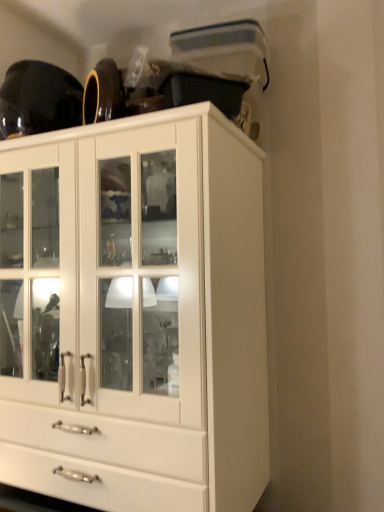
Identify the location of white glossy cupboard at center. Image resolution: width=384 pixels, height=512 pixels. (135, 313).

In the scene shown: Measure the distance between white glossy cupboard at center and camera.

white glossy cupboard at center and camera are 31.52 inches apart.

What do you see at coordinates (135, 313) in the screenshot?
I see `white glossy cupboard at center` at bounding box center [135, 313].

You are a GUI agent. You are given a task and a screenshot of the screen. Output one action in this format:
    pyautogui.click(x=<x>, y=<y>)
    Task: Click on the white glossy cupboard at center
    
    Given the screenshot: What is the action you would take?
    pyautogui.click(x=135, y=313)